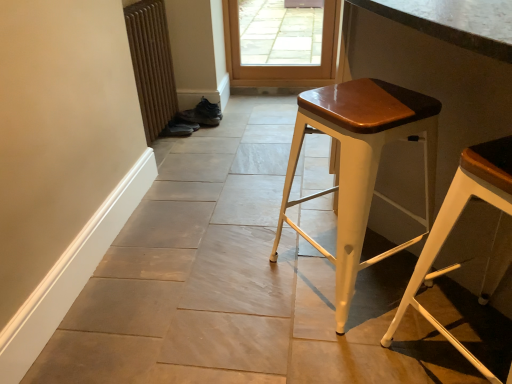
Question: Is matte white stool at center, which is the 1th stool from left to right, surrounding leather brown shoe at center, the 1th shoe viewed from the top?

Choices:
 (A) no
 (B) yes

Answer: (A)

Question: From the image's perspective, is matte white stool at center, which is the 1th stool from left to right, below leather brown shoe at center, the 2th shoe when ordered from bottom to top?

Choices:
 (A) yes
 (B) no

Answer: (A)

Question: Considering the relative positions of matte white stool at center, which is the 1th stool from left to right, and leather brown shoe at center, the 2th shoe when ordered from bottom to top, in the image provided, is matte white stool at center, which is the 1th stool from left to right, in front of leather brown shoe at center, the 2th shoe when ordered from bottom to top,?

Choices:
 (A) yes
 (B) no

Answer: (A)

Question: Is matte white stool at center, which is counted as the second stool, starting from the right, oriented away from leather brown shoe at center, the 1th shoe viewed from the top?

Choices:
 (A) no
 (B) yes

Answer: (A)

Question: Does matte white stool at center, which is the 1th stool from left to right, have a greater height compared to leather brown shoe at center, the 1th shoe viewed from the top?

Choices:
 (A) no
 (B) yes

Answer: (B)

Question: Considering the positions of leather brown shoe at center, the 1th shoe viewed from the top, and white metal stool at right, the 2th stool viewed from the left, in the image, is leather brown shoe at center, the 1th shoe viewed from the top, wider or thinner than white metal stool at right, the 2th stool viewed from the left,?

Choices:
 (A) wide
 (B) thin

Answer: (B)

Question: Considering the positions of leather brown shoe at center, the 1th shoe viewed from the top, and white metal stool at right, the 2th stool viewed from the left, in the image, is leather brown shoe at center, the 1th shoe viewed from the top, taller or shorter than white metal stool at right, the 2th stool viewed from the left,?

Choices:
 (A) short
 (B) tall

Answer: (A)

Question: From a real-world perspective, relative to white metal stool at right, marked as the 1th stool in a right-to-left arrangement, is leather brown shoe at center, the 2th shoe when ordered from bottom to top, vertically above or below?

Choices:
 (A) above
 (B) below

Answer: (B)

Question: From the image's perspective, relative to white metal stool at right, the 2th stool viewed from the left, is leather brown shoe at center, the 1th shoe viewed from the top, above or below?

Choices:
 (A) below
 (B) above

Answer: (B)

Question: Looking at the image, does white metal stool at right, the 2th stool viewed from the left, seem bigger or smaller compared to brown textured radiator at lower left?

Choices:
 (A) small
 (B) big

Answer: (B)

Question: Is white metal stool at right, the 2th stool viewed from the left, taller or shorter than brown textured radiator at lower left?

Choices:
 (A) tall
 (B) short

Answer: (B)

Question: Choose the correct answer: Is white metal stool at right, marked as the 1th stool in a right-to-left arrangement, inside brown textured radiator at lower left or outside it?

Choices:
 (A) inside
 (B) outside

Answer: (B)

Question: Is point (473, 157) positioned closer to the camera than point (140, 0)?

Choices:
 (A) closer
 (B) farther

Answer: (A)

Question: Considering the positions of leather brown shoe at center, the 2th shoe when ordered from bottom to top, and matte white stool at center, which is the 1th stool from left to right, in the image, is leather brown shoe at center, the 2th shoe when ordered from bottom to top, wider or thinner than matte white stool at center, which is the 1th stool from left to right,?

Choices:
 (A) wide
 (B) thin

Answer: (B)

Question: Is leather brown shoe at center, the 2th shoe when ordered from bottom to top, inside the boundaries of matte white stool at center, which is the 1th stool from left to right, or outside?

Choices:
 (A) inside
 (B) outside

Answer: (B)